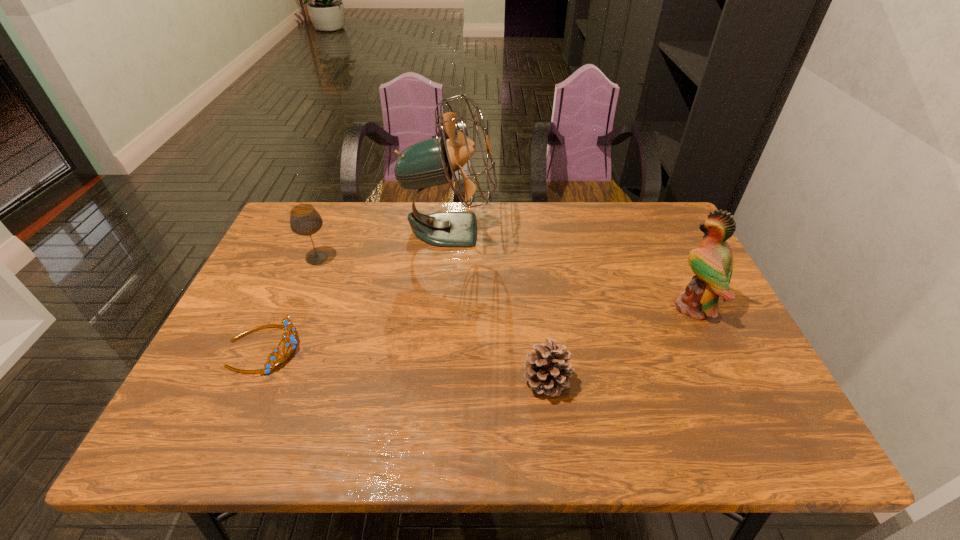
You are a GUI agent. You are given a task and a screenshot of the screen. Output one action in this format:
    pyautogui.click(x=<x>, y=<y>)
    Task: Click on the third object from left to right
    
    Given the screenshot: What is the action you would take?
    pyautogui.click(x=432, y=162)

Image resolution: width=960 pixels, height=540 pixels. In order to click on fan in this screenshot , I will do `click(432, 162)`.

Image resolution: width=960 pixels, height=540 pixels. Identify the location of the rightmost object. (712, 263).

Identify the location of the second tallest object. [712, 263].

The height and width of the screenshot is (540, 960). Identify the location of wineglass. (304, 219).

Locate an element on the screen. The height and width of the screenshot is (540, 960). pinecone is located at coordinates (548, 369).

Locate an element on the screen. This screenshot has height=540, width=960. the second object from right to left is located at coordinates (548, 369).

The height and width of the screenshot is (540, 960). I want to click on the shortest object, so click(x=287, y=325).

You are a GUI agent. You are given a task and a screenshot of the screen. Output one action in this format:
    pyautogui.click(x=<x>, y=<y>)
    Task: Click on the free space located on the front-facing side of the fan for air flow
    This screenshot has height=540, width=960.
    Given the screenshot: What is the action you would take?
    pyautogui.click(x=540, y=230)

The image size is (960, 540). What are the coordinates of `vacant space located on the front-facing side of the rightmost object` in the screenshot? It's located at (569, 307).